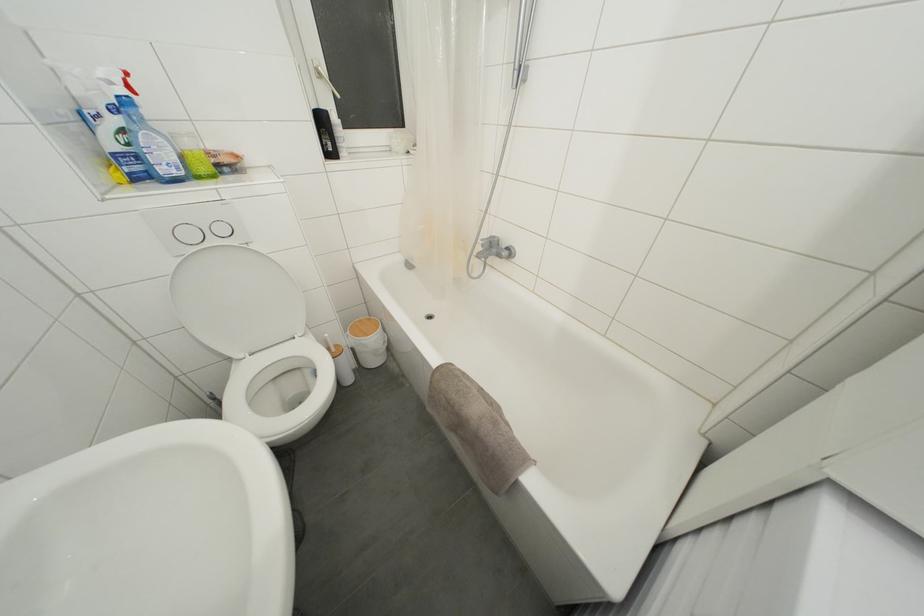
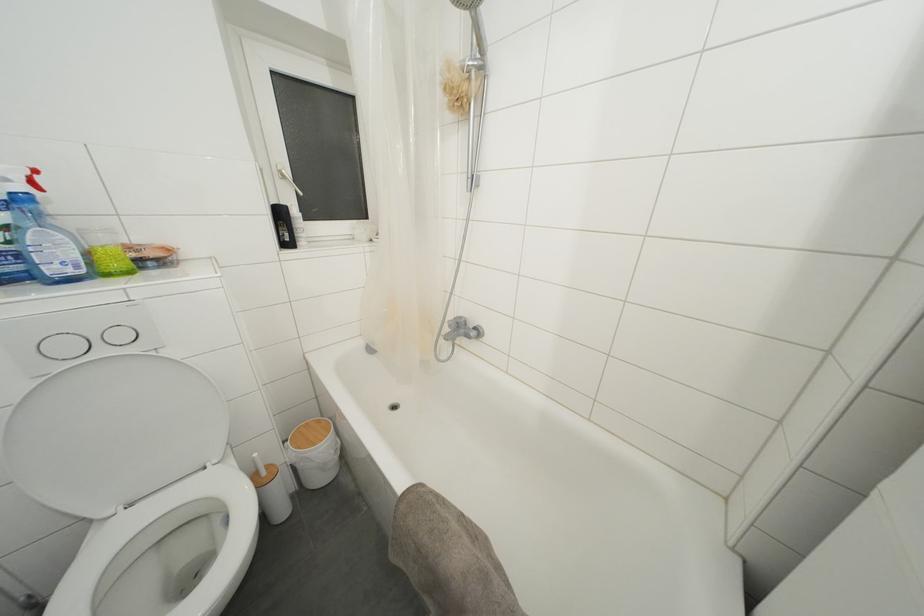
Question: Which direction would the cameraman need to move to produce the second image? Reply with the corresponding letter.

Choices:
 (A) Left
 (B) Right
 (C) Forward
 (D) Backward

Answer: (C)